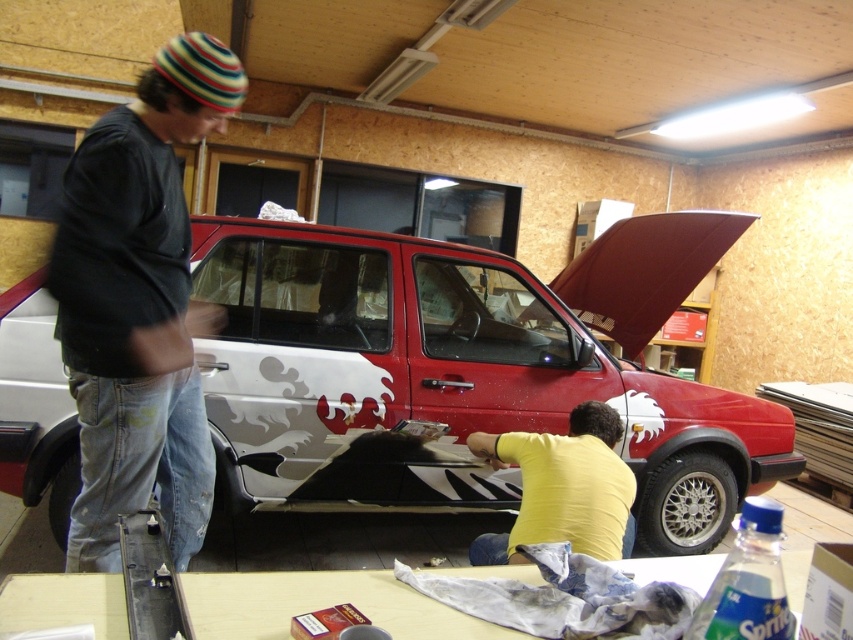
Can you confirm if striped knit cap at upper left is positioned to the right of yellow matte shirt at lower center?

No, striped knit cap at upper left is not to the right of yellow matte shirt at lower center.

Who is taller, striped knit cap at upper left or yellow matte shirt at lower center?

Standing taller between the two is striped knit cap at upper left.

Is point (142, 198) more distant than point (526, 440)?

No.

You are a GUI agent. You are given a task and a screenshot of the screen. Output one action in this format:
    pyautogui.click(x=<x>, y=<y>)
    Task: Click on the striped knit cap at upper left
    The width and height of the screenshot is (853, 640).
    Given the screenshot: What is the action you would take?
    pyautogui.click(x=138, y=305)

From the picture: Does red matte car at center appear under yellow matte shirt at lower center?

No.

In the scene shown: Who is positioned more to the right, red matte car at center or yellow matte shirt at lower center?

red matte car at center is more to the right.

Between point (318, 502) and point (564, 451), which one is positioned behind?

Positioned behind is point (318, 502).

Where is `red matte car at center`? The width and height of the screenshot is (853, 640). red matte car at center is located at coordinates (463, 371).

Is point (525, 337) more distant than point (209, 460)?

Yes, it is behind point (209, 460).

How far apart are red matte car at center and striped knit cap at upper left?

The distance of red matte car at center from striped knit cap at upper left is 4.45 feet.

Image resolution: width=853 pixels, height=640 pixels. What are the coordinates of `red matte car at center` in the screenshot? It's located at (463, 371).